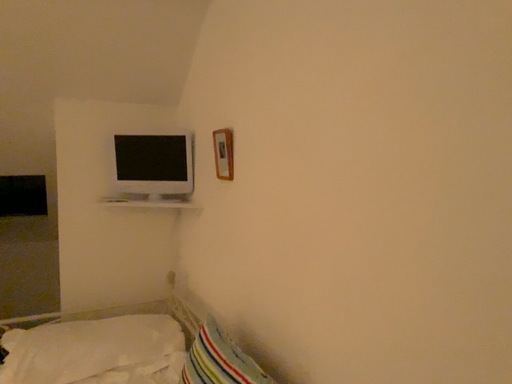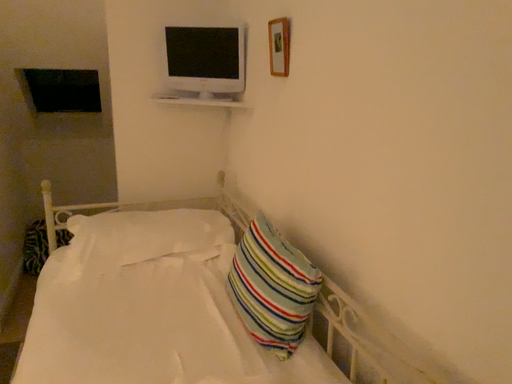
Question: How did the camera likely rotate when shooting the video?

Choices:
 (A) rotated upward
 (B) rotated downward

Answer: (B)